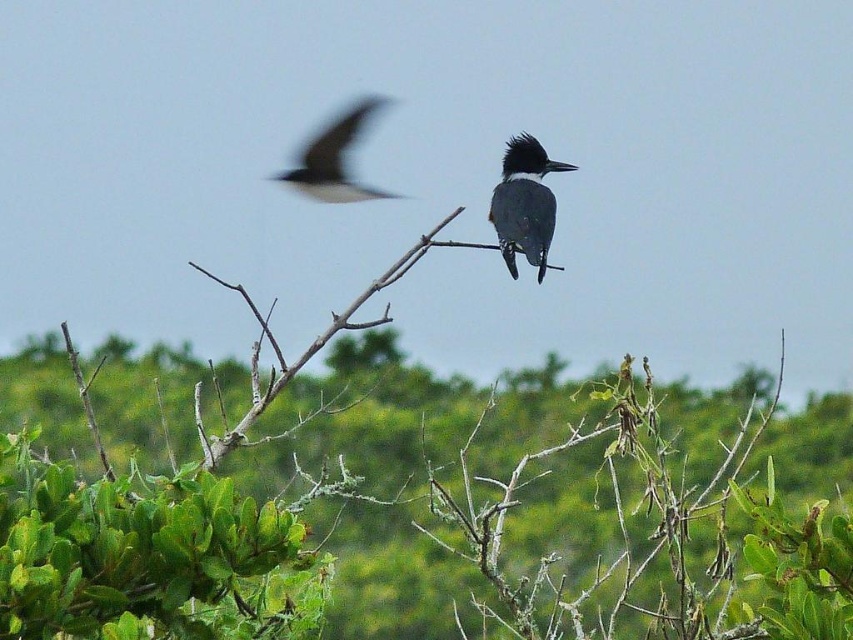
You are a wildlife photographer aiming to capture the gray glossy bird at center. Based on its position coordinates, where should you focus your camera lens?

The gray glossy bird at center is located at coordinates point [524,204], so you should focus your camera lens at that specific point to capture it clearly.

You are a photographer trying to focus on two points in the scene. The first point is point (529,202) and the second is point (334,154). Which point is closer to your camera lens?

Point (529,202) is closer to the camera than point (334,154).

You are a birdwatcher trying to identify the bird in the image. You notice both the brown rough branch at center and the gray glossy bird at center. Which object is bigger in size?

The brown rough branch at center is larger in size compared to the gray glossy bird at center.